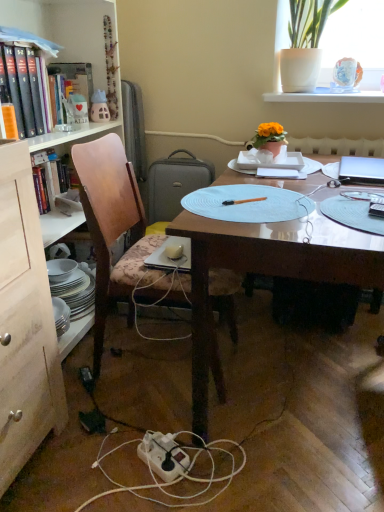
The image size is (384, 512). Find the location of `vacant space that is to the left of clear plastic pen at center`. vacant space that is to the left of clear plastic pen at center is located at coordinates (316, 203).